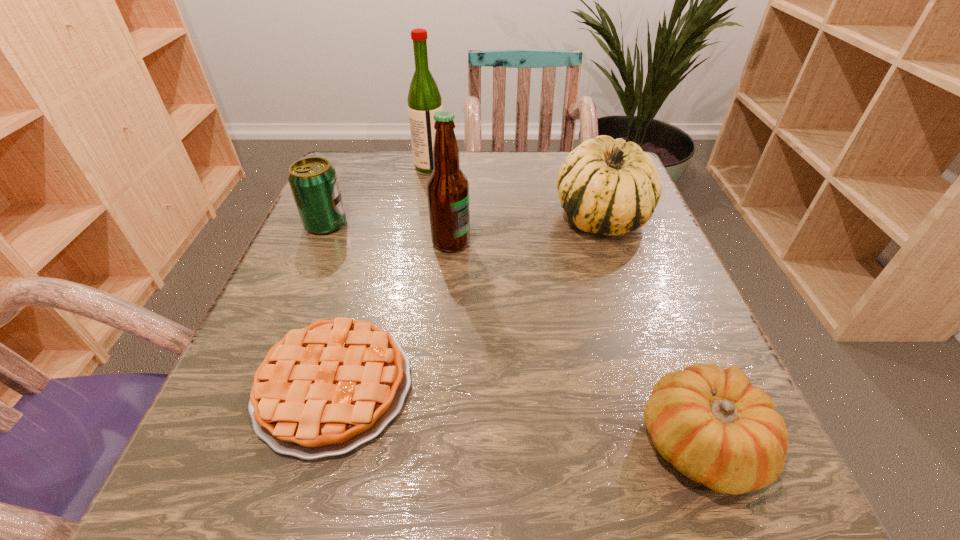
This screenshot has height=540, width=960. In order to click on empty space that is in between the nearer gourd and the fifth shortest object in this screenshot , I will do `click(575, 343)`.

The width and height of the screenshot is (960, 540). Identify the location of free space between the beer bottle and the shortest object. (393, 314).

At what (x,y) coordinates should I click in order to perform the action: click on unoccupied position between the taller gourd and the pie. Please return your answer as a coordinate pair (x, y). Looking at the image, I should click on (468, 302).

You are a GUI agent. You are given a task and a screenshot of the screen. Output one action in this format:
    pyautogui.click(x=<x>, y=<y>)
    Task: Click on the empty location between the pie and the second shortest object
    This screenshot has height=540, width=960.
    Given the screenshot: What is the action you would take?
    pyautogui.click(x=516, y=415)

Where is `free space between the pie and the second tallest object`? This screenshot has height=540, width=960. free space between the pie and the second tallest object is located at coordinates 393,314.

At what (x,y) coordinates should I click in order to perform the action: click on free space between the fourth tallest object and the beer bottle. Please return your answer as a coordinate pair (x, y). Image resolution: width=960 pixels, height=540 pixels. Looking at the image, I should click on [389, 233].

You are a GUI agent. You are given a task and a screenshot of the screen. Output one action in this format:
    pyautogui.click(x=<x>, y=<y>)
    Task: Click on the vacant area that lies between the fifth shortest object and the farther gourd
    
    Given the screenshot: What is the action you would take?
    pyautogui.click(x=526, y=230)

The image size is (960, 540). Find the location of `vacant point located between the fourth shortest object and the second tallest object`. vacant point located between the fourth shortest object and the second tallest object is located at coordinates (526, 230).

Select which object appears as the third closest to the farthest object. Please provide its 2D coordinates. Your answer should be formatted as a tuple, i.e. [(x, y)], where the tuple contains the x and y coordinates of a point satisfying the conditions above.

[(607, 186)]

This screenshot has height=540, width=960. What are the coordinates of `the closest object to the shortest object` in the screenshot? It's located at (447, 187).